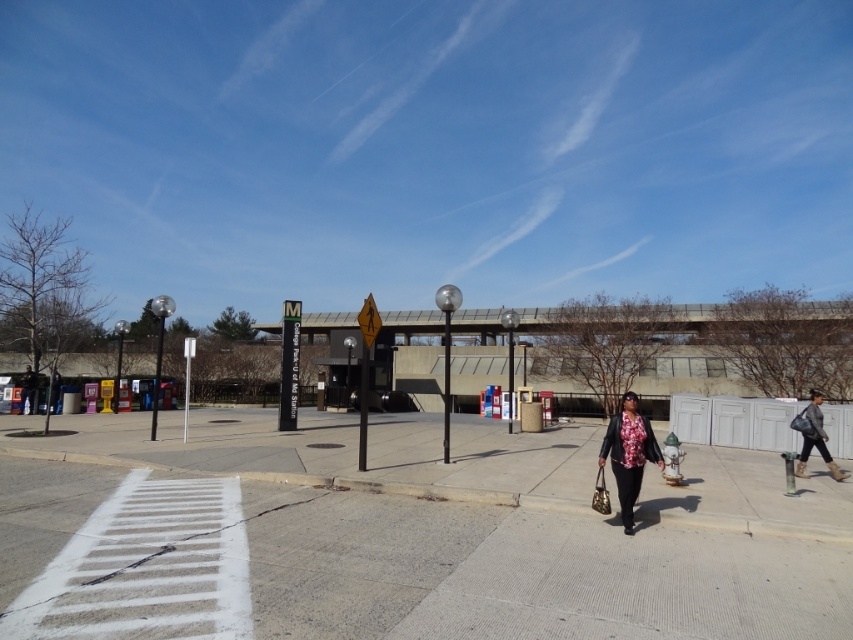
You are standing at the pedestrian crossing and want to determine which of the two points, point (643, 536) or point (805, 474), is closer to you. Based on the scene, which point is nearer?

Point (643, 536) is closer to the viewer than point (805, 474).

In the scene shown: You are standing at the origin point of the image coordinate system. The pedestrian crossing is marked by white stripes on the asphalt. Where is the white asphalt at lower left located in terms of coordinates?

The white asphalt at lower left is located at coordinates point (521, 573).

You are a delivery robot positioned at the point marked by the coordinates point [521,573]. You need to deliver a package to the woman walking on the pedestrian crossing. Which direction should you move to reach her?

Result: The point [521,573] marks white asphalt at lower left. The woman is on the pedestrian crossing in the foreground. To reach her, you should move towards the upper right direction from your current position at point [521,573].